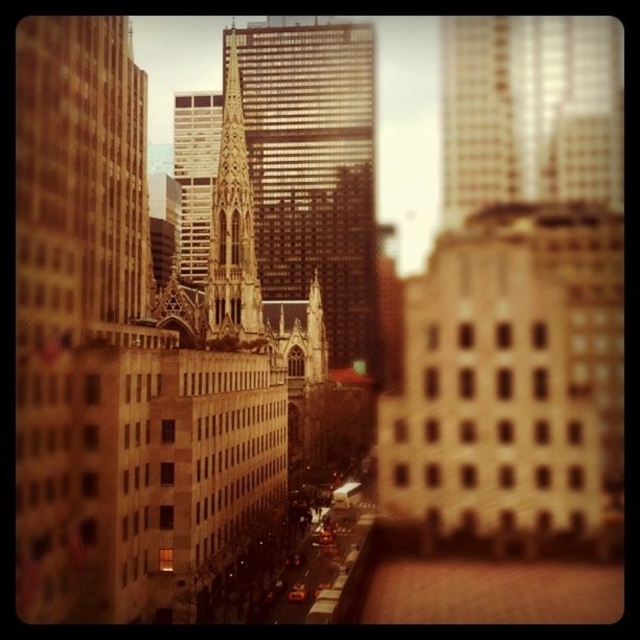
Is golden stone cathedral at center to the right of greenish-golden stone spire at center from the viewer's perspective?

Indeed, golden stone cathedral at center is positioned on the right side of greenish-golden stone spire at center.

Who is shorter, golden stone cathedral at center or greenish-golden stone spire at center?

With less height is greenish-golden stone spire at center.

Image resolution: width=640 pixels, height=640 pixels. I want to click on golden stone cathedral at center, so click(314, 172).

Does smooth glass skyscraper at upper center have a greater width compared to greenish-golden stone spire at center?

Yes, smooth glass skyscraper at upper center is wider than greenish-golden stone spire at center.

Which is below, smooth glass skyscraper at upper center or greenish-golden stone spire at center?

greenish-golden stone spire at center is below.

Does point (545, 58) come farther from viewer compared to point (230, 262)?

Yes.

You are a GUI agent. You are given a task and a screenshot of the screen. Output one action in this format:
    pyautogui.click(x=<x>, y=<y>)
    Task: Click on the smooth glass skyscraper at upper center
    Image resolution: width=640 pixels, height=640 pixels.
    Given the screenshot: What is the action you would take?
    [x=531, y=112]

Who is shorter, golden stone cathedral at center or smooth glass skyscraper at upper center?

smooth glass skyscraper at upper center is shorter.

Between golden stone cathedral at center and smooth glass skyscraper at upper center, which one appears on the right side from the viewer's perspective?

smooth glass skyscraper at upper center is more to the right.

Measure the distance between point (x=243, y=42) and camera.

The distance of point (x=243, y=42) from camera is 173.12 meters.

The image size is (640, 640). I want to click on golden stone cathedral at center, so click(x=314, y=172).